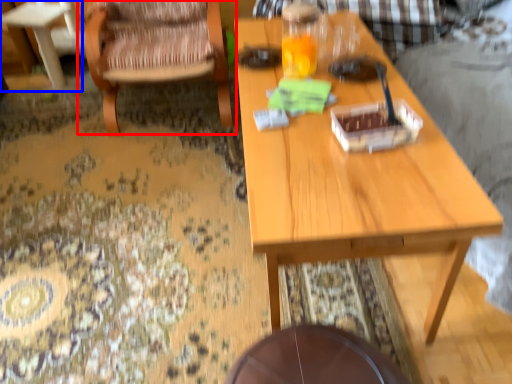
Question: Which object is closer to the camera taking this photo, chair (highlighted by a red box) or coffee table (highlighted by a blue box)?

Choices:
 (A) chair
 (B) coffee table

Answer: (A)